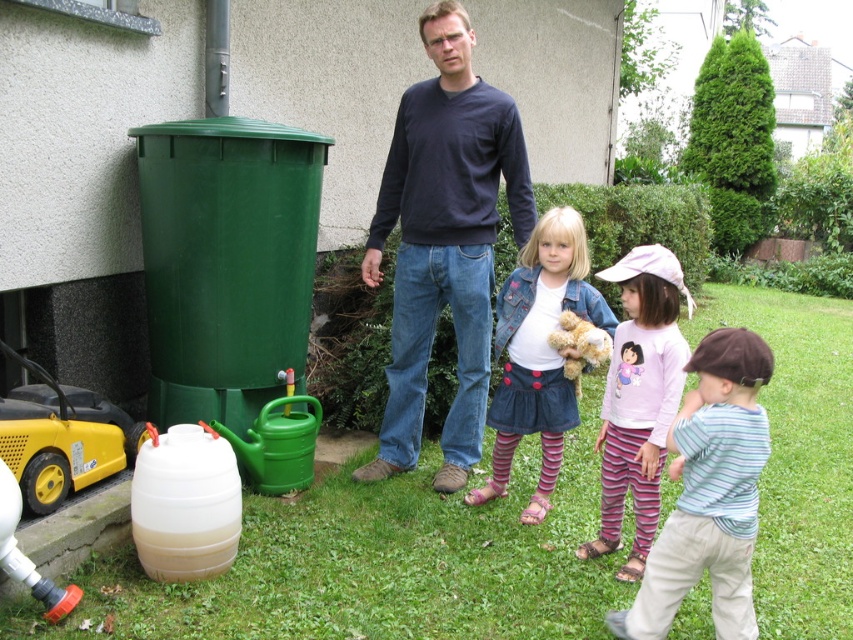
Question: Which point appears closest to the camera in this image?

Choices:
 (A) 468,364
 (B) 659,438
 (C) 648,332

Answer: (B)

Question: Does dark blue sweater at center appear over denim jacket at center?

Choices:
 (A) no
 (B) yes

Answer: (B)

Question: Which point appears closest to the camera in this image?

Choices:
 (A) (572, 358)
 (B) (680, 372)
 (C) (665, 524)

Answer: (C)

Question: From the image, what is the correct spatial relationship of striped cotton pants at lower right in relation to pink cotton shirt at center?

Choices:
 (A) left
 (B) right

Answer: (B)

Question: Considering the relative positions of striped cotton pants at center and striped cotton pants at lower right in the image provided, where is striped cotton pants at center located with respect to striped cotton pants at lower right?

Choices:
 (A) left
 (B) right

Answer: (A)

Question: Which is nearer to the pink cotton shirt at center?

Choices:
 (A) dark blue sweater at center
 (B) striped cotton pants at lower right
 (C) denim jacket at center

Answer: (C)